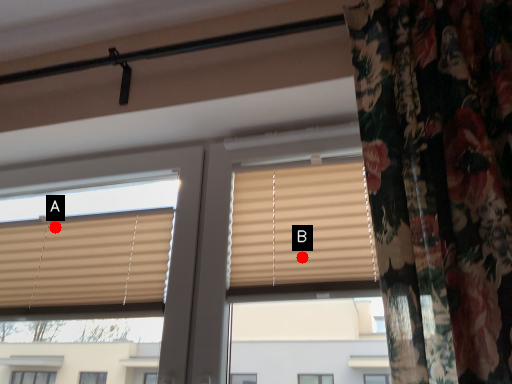
Question: Two points are circled on the image, labeled by A and B beside each circle. Which of the following is the closest to the observer?

Choices:
 (A) A is closer
 (B) B is closer

Answer: (B)